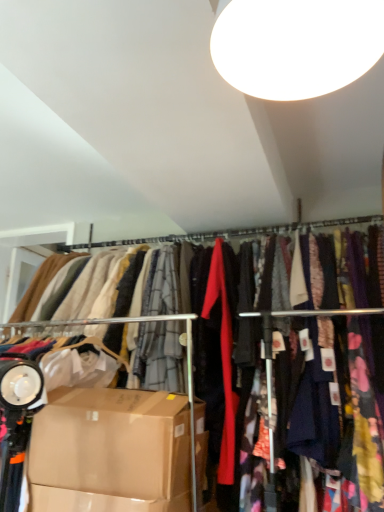
Question: Considering the relative positions of silky fabric clothesline at center and brown cardboard box at lower left in the image provided, is silky fabric clothesline at center behind brown cardboard box at lower left?

Choices:
 (A) no
 (B) yes

Answer: (B)

Question: Considering the relative positions of silky fabric clothesline at center and brown cardboard box at lower left in the image provided, is silky fabric clothesline at center to the left of brown cardboard box at lower left from the viewer's perspective?

Choices:
 (A) yes
 (B) no

Answer: (B)

Question: Does silky fabric clothesline at center have a greater height compared to brown cardboard box at lower left?

Choices:
 (A) yes
 (B) no

Answer: (B)

Question: Can you confirm if silky fabric clothesline at center is wider than brown cardboard box at lower left?

Choices:
 (A) yes
 (B) no

Answer: (B)

Question: Can you confirm if silky fabric clothesline at center is bigger than brown cardboard box at lower left?

Choices:
 (A) no
 (B) yes

Answer: (A)

Question: Is the depth of silky fabric clothesline at center less than that of brown cardboard box at lower left?

Choices:
 (A) yes
 (B) no

Answer: (B)

Question: From the image's perspective, does brown cardboard box at lower left appear higher than silky fabric clothesline at center?

Choices:
 (A) yes
 (B) no

Answer: (B)

Question: Does brown cardboard box at lower left have a lesser width compared to silky fabric clothesline at center?

Choices:
 (A) yes
 (B) no

Answer: (B)

Question: Would you say brown cardboard box at lower left is outside silky fabric clothesline at center?

Choices:
 (A) yes
 (B) no

Answer: (A)

Question: Can you confirm if brown cardboard box at lower left is bigger than silky fabric clothesline at center?

Choices:
 (A) yes
 (B) no

Answer: (A)

Question: Does brown cardboard box at lower left have a smaller size compared to silky fabric clothesline at center?

Choices:
 (A) no
 (B) yes

Answer: (A)

Question: Can silky fabric clothesline at center be found inside brown cardboard box at lower left?

Choices:
 (A) yes
 (B) no

Answer: (B)

Question: Can you confirm if white glossy light fixture at upper center is shorter than brown cardboard box at lower left?

Choices:
 (A) no
 (B) yes

Answer: (B)